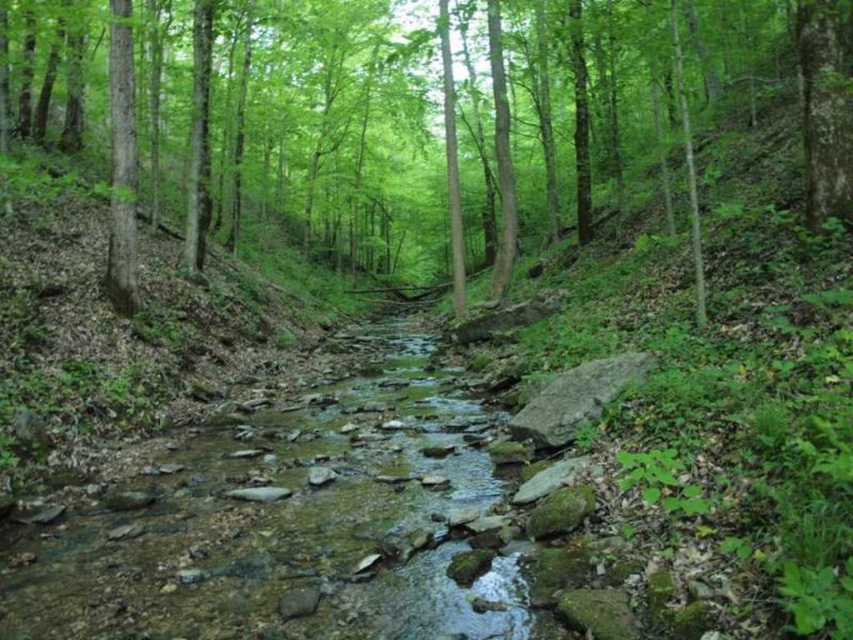
Based on the photo, you are a hiker trying to cross the stream. You see the green leafy tree at center and the clear water at stream center. Which object would you use to stabilize yourself while crossing?

The green leafy tree at center is bigger than the clear water at stream center, so you can use the green leafy tree at center to stabilize yourself while crossing the stream.

You are a hiker standing in the forest and want to take a photo of the green leafy tree at center and the clear water at stream center. Which object should you focus on first if you want to capture both in one frame without moving your camera?

The green leafy tree at center is taller than the clear water at stream center, so you should focus on the green leafy tree at center first to ensure it fits in the frame.

You are standing at the edge of the stream in the forest scene. You notice a point marked at coordinates (427, 108). Which object in the scene corresponds to that point?

The point at coordinates (427, 108) corresponds to the green leafy tree at center.